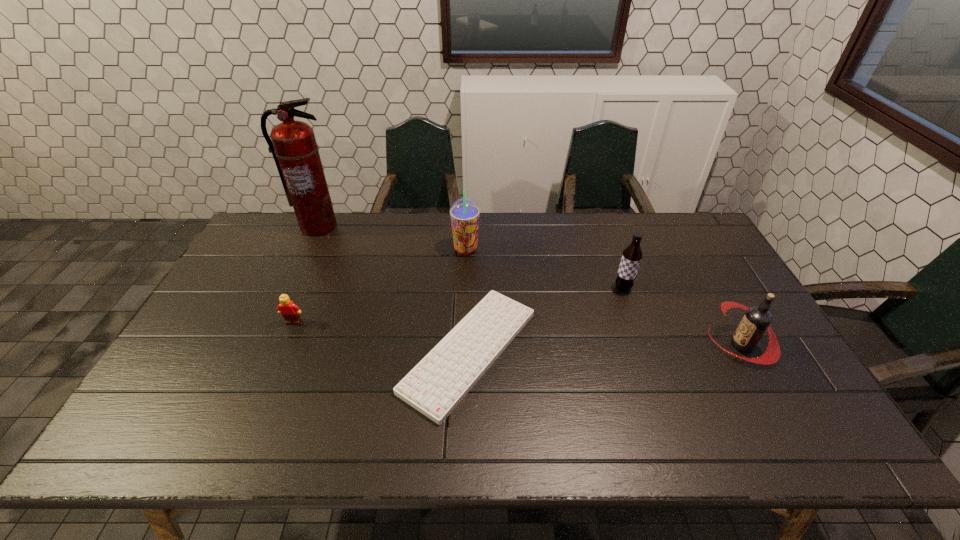
Image resolution: width=960 pixels, height=540 pixels. Identify the location of free spot between the tallest object and the Lego. (305, 274).

This screenshot has height=540, width=960. Find the location of `vacant area between the computer keyboard and the tallest object`. vacant area between the computer keyboard and the tallest object is located at coordinates (394, 288).

Identify the location of unoccupied area between the fire extinguisher and the smoothie. (392, 238).

Image resolution: width=960 pixels, height=540 pixels. Identify the location of unoccupied area between the smoothie and the Lego. (379, 286).

Locate an element on the screen. Image resolution: width=960 pixels, height=540 pixels. vacant point located between the fifth tallest object and the fire extinguisher is located at coordinates (305, 274).

Where is `vacant area that lies between the second shortest object and the fifth object from left to right`? The width and height of the screenshot is (960, 540). vacant area that lies between the second shortest object and the fifth object from left to right is located at coordinates (458, 305).

In order to click on vacant area that lies between the tallest object and the fifth nearest object in this screenshot , I will do `click(392, 238)`.

The image size is (960, 540). I want to click on object that is the closest to the smoothie, so click(x=436, y=385).

Identify which object is the fifth nearest to the Lego. Please provide its 2D coordinates. Your answer should be formatted as a tuple, i.e. [(x, y)], where the tuple contains the x and y coordinates of a point satisfying the conditions above.

[(757, 319)]

Where is `vacant position in the image that satisfies the following two spatial constraints: 1. on the label of the right root beer; 2. on the front side of the computer keyboard`? The image size is (960, 540). vacant position in the image that satisfies the following two spatial constraints: 1. on the label of the right root beer; 2. on the front side of the computer keyboard is located at coordinates (745, 351).